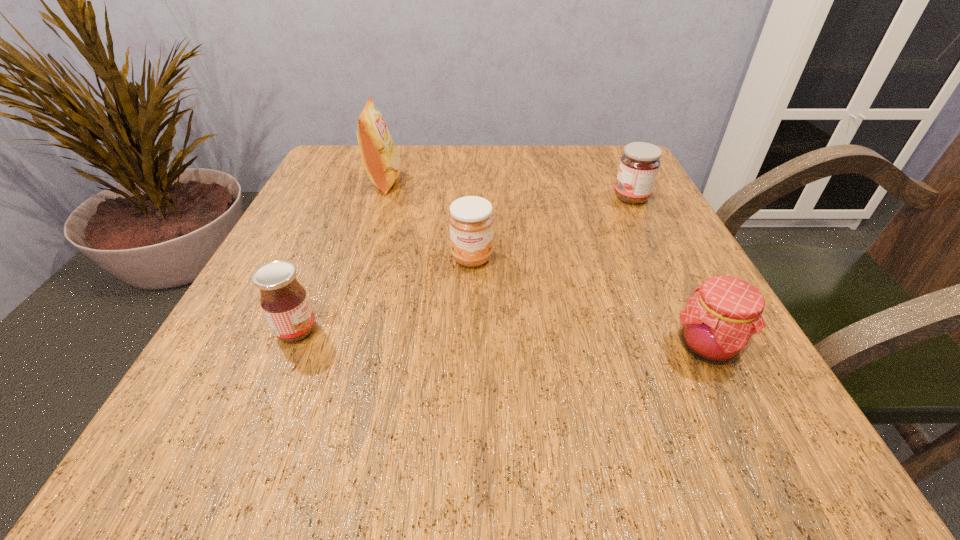
You are a GUI agent. You are given a task and a screenshot of the screen. Output one action in this format:
    pyautogui.click(x=<x>, y=<y>)
    Task: Click on the tallest object
    The image size is (960, 540).
    Given the screenshot: What is the action you would take?
    pyautogui.click(x=382, y=163)

This screenshot has height=540, width=960. Find the location of `the leftmost jam`. the leftmost jam is located at coordinates (284, 301).

Identify the location of the farthest jam. (639, 165).

You are a GUI agent. You are given a task and a screenshot of the screen. Output one action in this format:
    pyautogui.click(x=<x>, y=<y>)
    Task: Click on the third object from right to left
    
    Given the screenshot: What is the action you would take?
    pyautogui.click(x=471, y=222)

You are a GUI agent. You are given a task and a screenshot of the screen. Output one action in this format:
    pyautogui.click(x=<x>, y=<y>)
    Task: Click on the second farthest jam
    
    Given the screenshot: What is the action you would take?
    pyautogui.click(x=471, y=222)

Where is `free spot located on the front-facing side of the crisp (potato chip)`? free spot located on the front-facing side of the crisp (potato chip) is located at coordinates (513, 182).

Identify the location of vacant space located 0.320m on the label side of the leftmost jam. The width and height of the screenshot is (960, 540). [533, 330].

Where is `blank space located 0.160m on the left of the farthest jam`? The height and width of the screenshot is (540, 960). blank space located 0.160m on the left of the farthest jam is located at coordinates (538, 198).

You are a GUI agent. You are given a task and a screenshot of the screen. Output one action in this format:
    pyautogui.click(x=<x>, y=<y>)
    Task: Click on the vacant space positioned 0.120m on the front label of the third jam from right to left
    This screenshot has width=960, height=540.
    Given the screenshot: What is the action you would take?
    pyautogui.click(x=470, y=323)

I want to click on crisp (potato chip) located in the far edge section of the desktop, so click(382, 163).